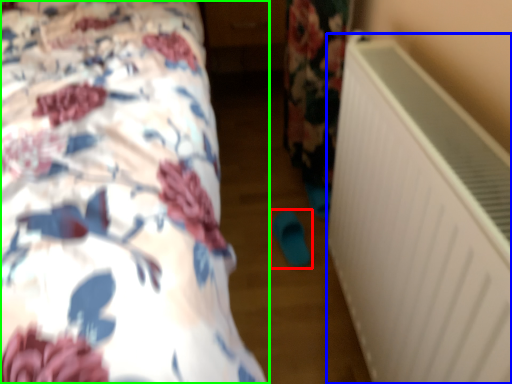
Question: Which object is the farthest from footwear (highlighted by a red box)? Choose among these: air conditioning (highlighted by a blue box) or bed (highlighted by a green box).

Choices:
 (A) air conditioning
 (B) bed

Answer: (B)